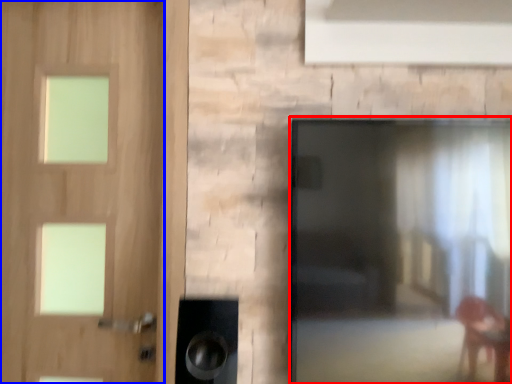
Question: Which of the following is the farthest to the observer, screen door (highlighted by a red box) or door (highlighted by a blue box)?

Choices:
 (A) screen door
 (B) door

Answer: (B)